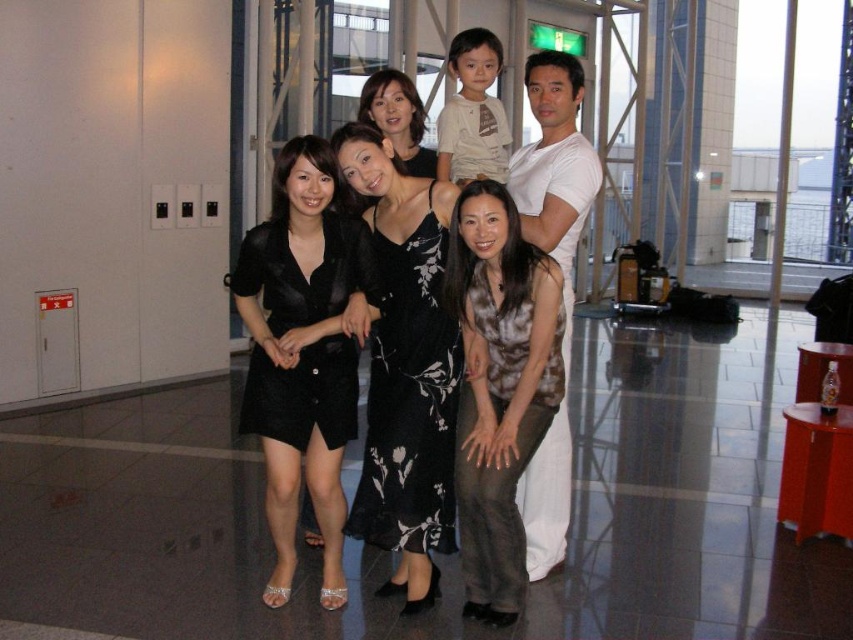
What is located at the coordinates point [302,353] in the image?

The point [302,353] is where the satin black dress at center is located.

You are standing at the center of the room and want to take a photo of both the point at coordinates point (247,282) and point (421,147). Which point should you move towards to ensure both are in frame?

You should move towards point (421,147) because point (247,282) is in front of point (421,147). Moving towards the further point allows both to be captured in the frame.

Looking at the group of people in the image, which of the two dresses is positioned to the left side? The options are the black satin dress at center and the black floral dress at center.

The black satin dress at center is positioned to the left of the black floral dress at center.